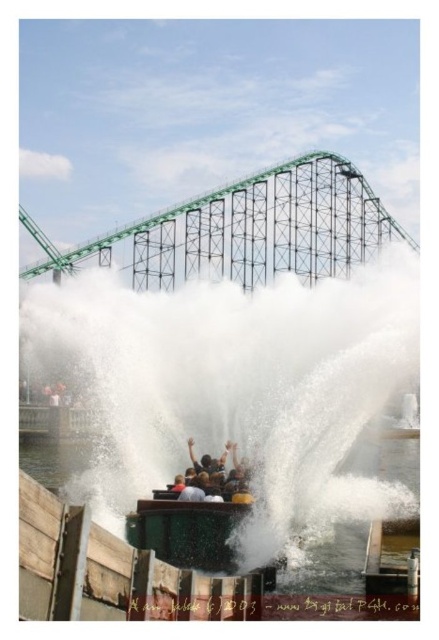
Question: Does white frothy water at center appear under white frothy water at lower center?

Choices:
 (A) no
 (B) yes

Answer: (A)

Question: Does white frothy water at center appear on the left side of dark brown hair at center?

Choices:
 (A) no
 (B) yes

Answer: (A)

Question: Is white frothy water at center to the right of white frothy water at lower center from the viewer's perspective?

Choices:
 (A) yes
 (B) no

Answer: (A)

Question: Which of the following is the closest to the observer?

Choices:
 (A) (338, 557)
 (B) (220, 468)

Answer: (A)

Question: Which point is farther from the camera taking this photo?

Choices:
 (A) click(x=197, y=394)
 (B) click(x=208, y=467)

Answer: (A)

Question: Which of these objects is positioned farthest from the white frothy water at lower center?

Choices:
 (A) white frothy water at center
 (B) dark brown hair at center

Answer: (A)